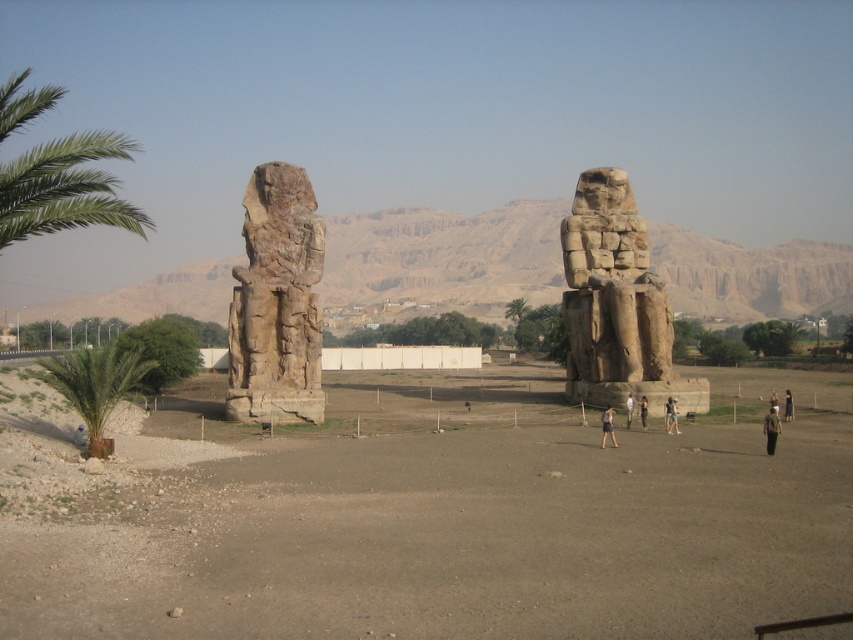
Question: Which object is positioned closest to the dark brown leather pants at center?

Choices:
 (A) black fabric person at center
 (B) green leafy palm at left
 (C) light brown skin at center
 (D) brown fabric person at lower right

Answer: (C)

Question: Can you confirm if green leafy palm tree at left is positioned to the left of brown fabric bag at lower left?

Choices:
 (A) no
 (B) yes

Answer: (B)

Question: Among these objects, which one is nearest to the camera?

Choices:
 (A) rustic stone statue at center
 (B) brown fabric person at center
 (C) light brown skin at center

Answer: (B)

Question: Which object appears closest to the camera in this image?

Choices:
 (A) dark gray fabric dress at center
 (B) brown fabric person at lower right

Answer: (B)

Question: Is rough stone statue at left smaller than brown fabric bag at lower left?

Choices:
 (A) no
 (B) yes

Answer: (A)

Question: Is brown fabric person at lower right to the right of dark gray fabric dress at center from the viewer's perspective?

Choices:
 (A) yes
 (B) no

Answer: (A)